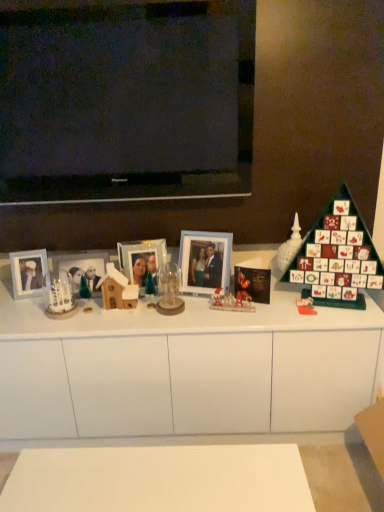
Identify the location of empty space that is in between wooden house at center, the first toy from the left, and matte plastic toy at right, the 5th toy viewed from the left. This screenshot has height=512, width=384. (232, 308).